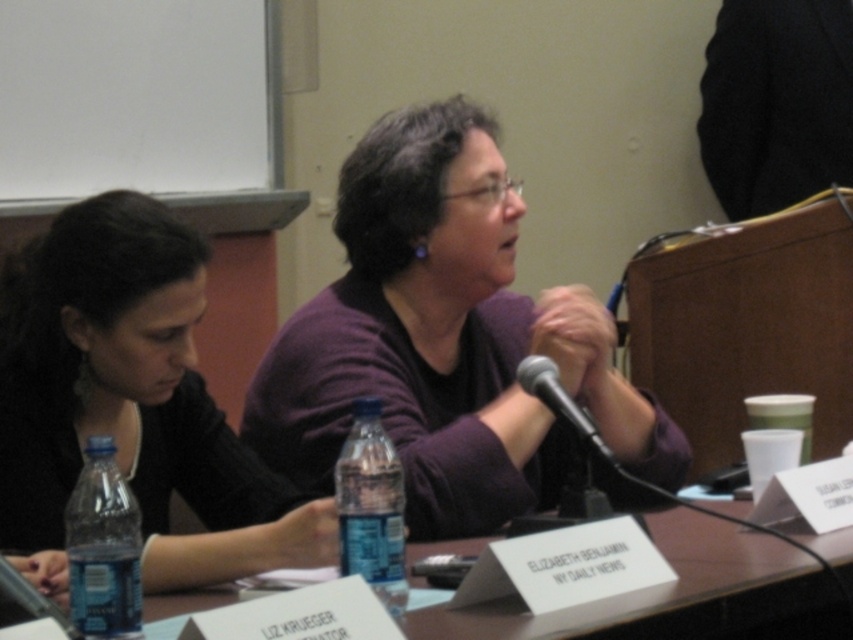
You are organizing a conference and need to place a new nameplate between the black matte shirt at left and the blue plastic bottle at lower left. Based on their positions, where should you place the nameplate?

The black matte shirt at left is to the left of the blue plastic bottle at lower left, so the nameplate should be placed between them on the table, to the right of the black matte shirt at left and to the left of the blue plastic bottle at lower left.

You are a photographer standing at a distance. You want to take a closeup photo of the purple matte sweater at center without moving the camera. Is it possible to do so with the current setup?

The purple matte sweater at center is 5.21 feet away from the viewer, so if the camera has a zoom lens capable of focusing on objects at that distance, it is possible to take a closeup photo without moving the camera.

You are organizing a small conference and need to ensure there is enough space between the purple matte sweater at center and the clear plastic water bottle at lower left for a 30 cm wide laptop. Is there sufficient space between them?

The purple matte sweater at center is 38.33 centimeters away from the clear plastic water bottle at lower left, which is more than enough space for a 30 cm wide laptop.